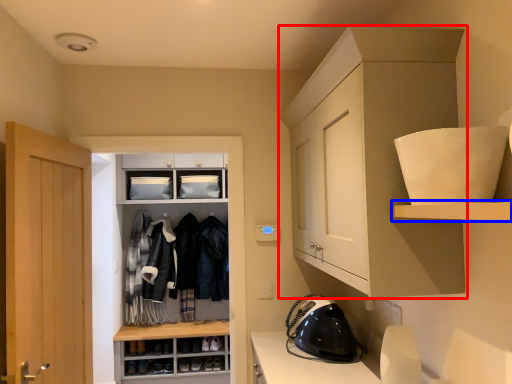
Question: Among these objects, which one is nearest to the camera, cabinetry (highlighted by a red box) or shelf (highlighted by a blue box)?

Choices:
 (A) cabinetry
 (B) shelf

Answer: (B)